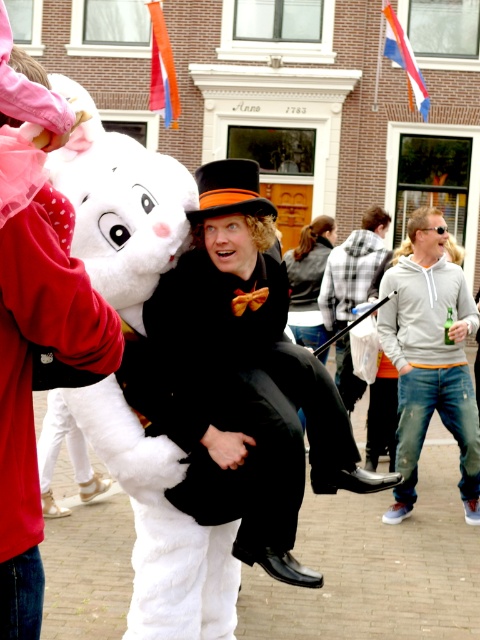
Question: Does denim jeans at right have a greater width compared to black leather jacket at center?

Choices:
 (A) yes
 (B) no

Answer: (B)

Question: Which of the following is the closest to the observer?

Choices:
 (A) (309, 292)
 (B) (344, 374)
 (C) (226, 237)
 (D) (204, 216)

Answer: (D)

Question: Does denim jeans at right appear on the right side of black leather jacket at center?

Choices:
 (A) yes
 (B) no

Answer: (A)

Question: Which object is farther from the camera taking this photo?

Choices:
 (A) black leather jacket at center
 (B) orange felt dress hat at center
 (C) denim jeans at right

Answer: (A)

Question: Can you confirm if shiny black coat at center is positioned to the left of denim jeans at right?

Choices:
 (A) no
 (B) yes

Answer: (B)

Question: Which of the following is the farthest from the observer?

Choices:
 (A) (294, 508)
 (B) (340, 356)
 (C) (469, 392)

Answer: (B)